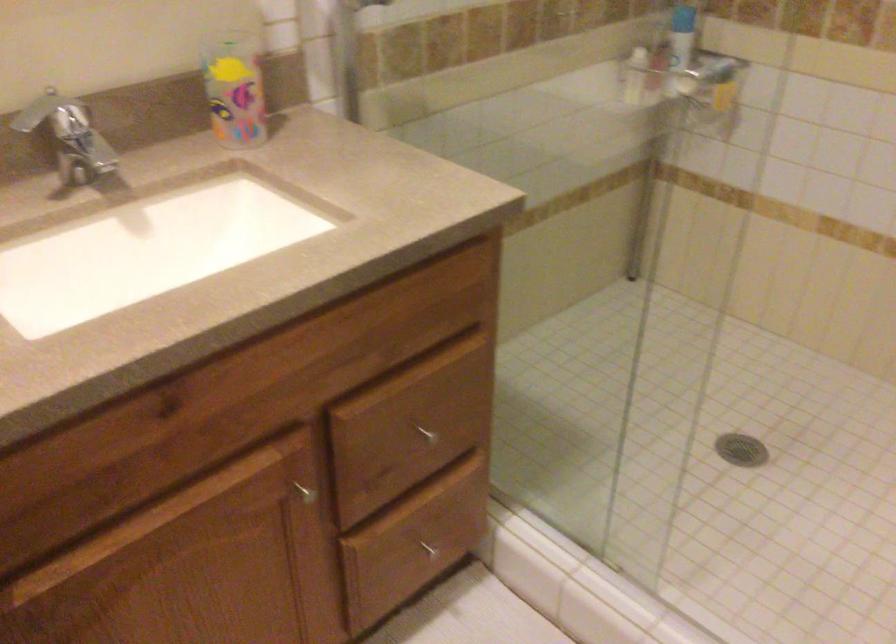
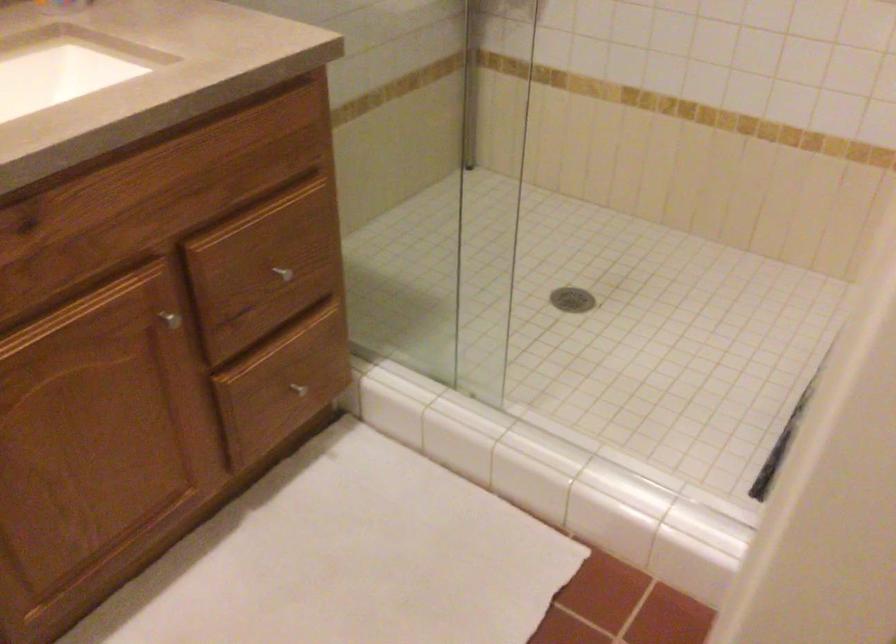
Where in the second image is the point corresponding to point 428,547 from the first image?

(297, 389)